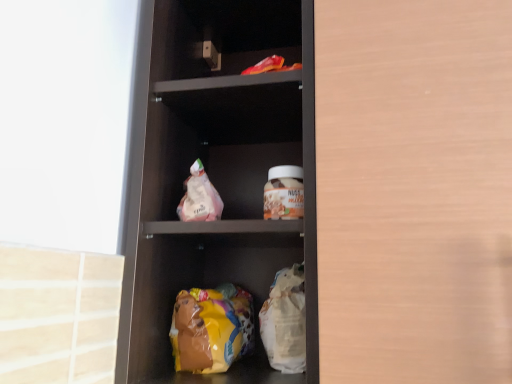
Question: Is translucent plastic bag at center turned away from yellow plastic bag at lower center?

Choices:
 (A) yes
 (B) no

Answer: (B)

Question: Considering the relative sizes of translucent plastic bag at center and yellow plastic bag at lower center in the image provided, is translucent plastic bag at center wider than yellow plastic bag at lower center?

Choices:
 (A) yes
 (B) no

Answer: (B)

Question: Is the depth of translucent plastic bag at center greater than that of yellow plastic bag at lower center?

Choices:
 (A) yes
 (B) no

Answer: (A)

Question: From the image's perspective, does translucent plastic bag at center appear higher than yellow plastic bag at lower center?

Choices:
 (A) yes
 (B) no

Answer: (A)

Question: Is translucent plastic bag at center smaller than yellow plastic bag at lower center?

Choices:
 (A) no
 (B) yes

Answer: (B)

Question: From a real-world perspective, is translucent plastic bag at center under yellow plastic bag at lower center?

Choices:
 (A) no
 (B) yes

Answer: (A)

Question: From a real-world perspective, is wooden cabinet door at right positioned under yellow plastic bag at lower center based on gravity?

Choices:
 (A) yes
 (B) no

Answer: (B)

Question: Is wooden cabinet door at right positioned with its back to yellow plastic bag at lower center?

Choices:
 (A) yes
 (B) no

Answer: (B)

Question: Considering the relative sizes of wooden cabinet door at right and yellow plastic bag at lower center in the image provided, is wooden cabinet door at right wider than yellow plastic bag at lower center?

Choices:
 (A) yes
 (B) no

Answer: (A)

Question: Can you confirm if wooden cabinet door at right is smaller than yellow plastic bag at lower center?

Choices:
 (A) no
 (B) yes

Answer: (A)

Question: Does wooden cabinet door at right appear on the right side of yellow plastic bag at lower center?

Choices:
 (A) no
 (B) yes

Answer: (B)

Question: From the image's perspective, would you say wooden cabinet door at right is shown under yellow plastic bag at lower center?

Choices:
 (A) yes
 (B) no

Answer: (B)

Question: Is translucent plastic bag at center at the back of matte plastic shelf at center?

Choices:
 (A) no
 (B) yes

Answer: (B)